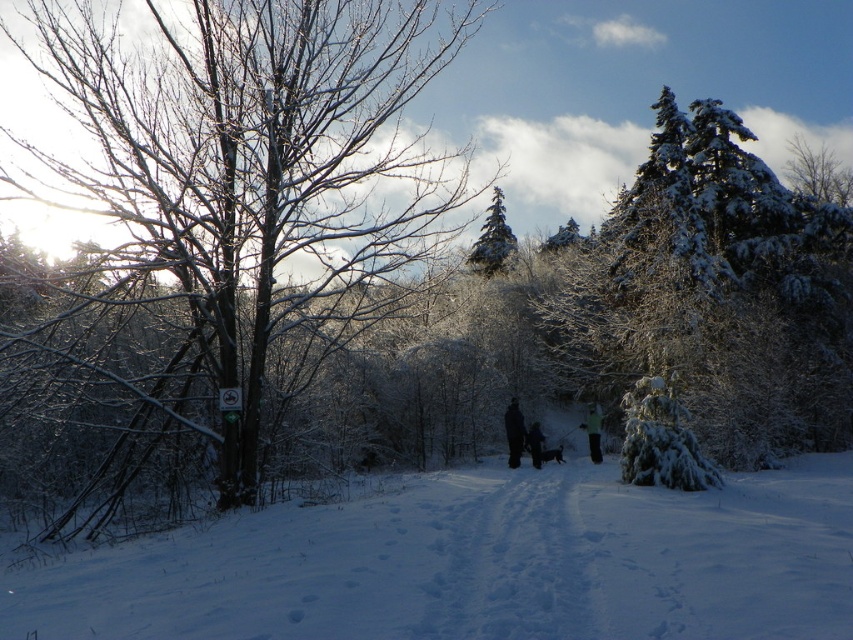
Measure the distance between white fluffy snow at center and green fuzzy jacket at center.

white fluffy snow at center and green fuzzy jacket at center are 15.20 meters apart from each other.

Who is taller, white fluffy snow at center or green fuzzy jacket at center?

Standing taller between the two is green fuzzy jacket at center.

Does point (631, 605) come behind point (590, 458)?

No, it is in front of (590, 458).

The image size is (853, 640). In order to click on white fluffy snow at center in this screenshot , I will do tap(479, 564).

Between point (469, 566) and point (646, 269), which one is positioned in front?

Positioned in front is point (469, 566).

From the picture: Is white fluffy snow at center positioned at the back of snow-covered evergreen at upper right?

No.

Locate an element on the screen. white fluffy snow at center is located at coordinates (479, 564).

Between snow-covered tree at left and green fuzzy jacket at center, which one is positioned higher?

snow-covered tree at left

Measure the distance between snow-covered tree at left and camera.

snow-covered tree at left is 39.55 feet from camera.

Find the location of a particular element. Image resolution: width=853 pixels, height=640 pixels. snow-covered tree at left is located at coordinates (241, 198).